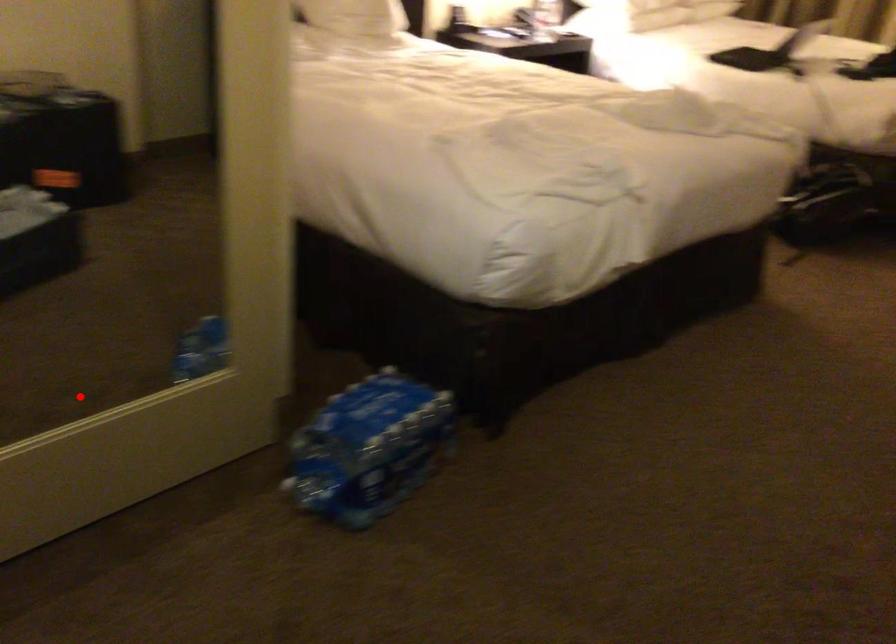
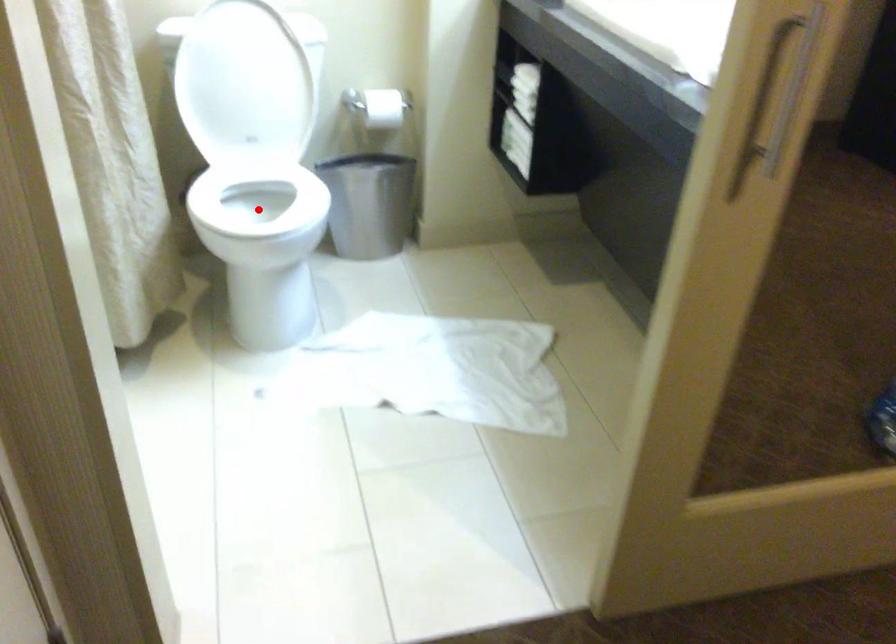
I am providing you with two images of the same scene from different viewpoints. A red point is marked on the first image and another point is marked on the second image. Is the marked point in image1 the same physical position as the marked point in image2?

No